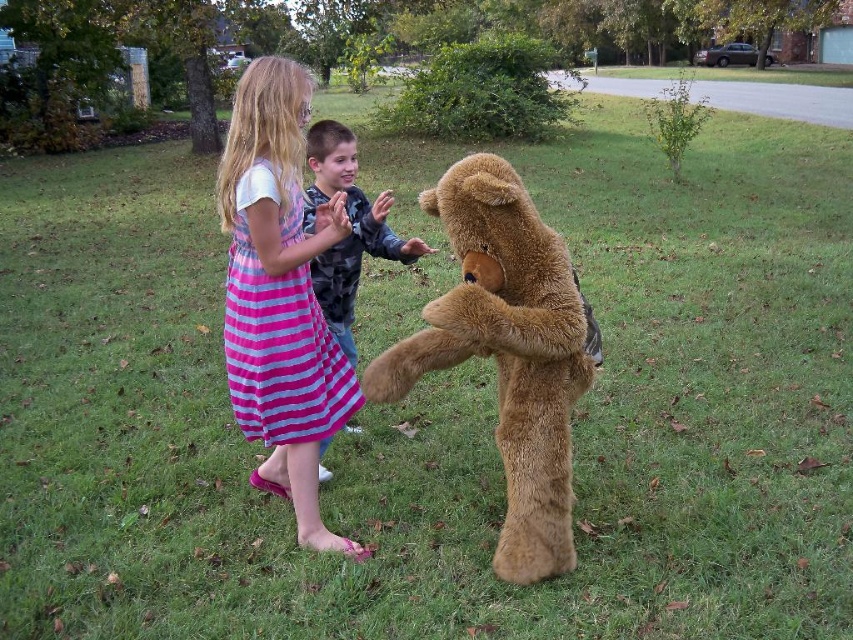
Question: Does fuzzy brown teddy bear at center have a greater width compared to camouflage jacket at center?

Choices:
 (A) yes
 (B) no

Answer: (A)

Question: Can you confirm if fuzzy brown teddy bear at center is positioned above pink striped dress at center?

Choices:
 (A) yes
 (B) no

Answer: (B)

Question: Among these points, which one is nearest to the camera?

Choices:
 (A) 465,260
 (B) 268,259

Answer: (A)

Question: Is pink striped dress at center bigger than camouflage jacket at center?

Choices:
 (A) no
 (B) yes

Answer: (B)

Question: Which point appears farthest from the camera in this image?

Choices:
 (A) (519, 435)
 (B) (396, 237)
 (C) (252, 480)

Answer: (B)

Question: Estimate the real-world distances between objects in this image. Which object is closer to the camouflage jacket at center?

Choices:
 (A) fuzzy brown teddy bear at center
 (B) pink striped dress at center

Answer: (B)